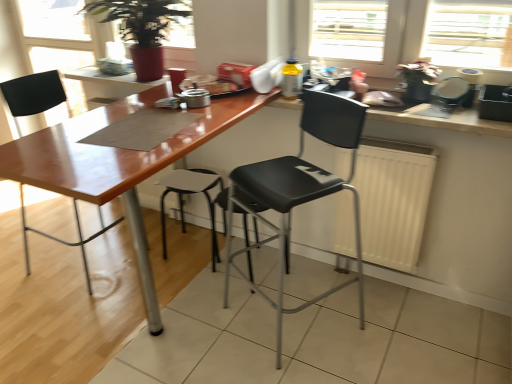
Question: Is black plastic chair at center, placed as the 1th chair when sorted from right to left, bigger than wooden countertop at upper right?

Choices:
 (A) yes
 (B) no

Answer: (A)

Question: From a real-world perspective, is black plastic chair at center, placed as the 1th chair when sorted from right to left, over wooden countertop at upper right?

Choices:
 (A) no
 (B) yes

Answer: (A)

Question: Is black plastic chair at center, placed as the 1th chair when sorted from right to left, next to wooden countertop at upper right?

Choices:
 (A) yes
 (B) no

Answer: (B)

Question: Is black plastic chair at center, placed as the 1th chair when sorted from right to left, thinner than wooden countertop at upper right?

Choices:
 (A) no
 (B) yes

Answer: (A)

Question: Can you confirm if black plastic chair at center, which is the second chair from left to right, is wider than wooden countertop at upper right?

Choices:
 (A) no
 (B) yes

Answer: (B)

Question: Which is correct: white matte radiator at center is inside matte black stool at center, or outside of it?

Choices:
 (A) outside
 (B) inside

Answer: (A)

Question: In terms of height, does white matte radiator at center look taller or shorter compared to matte black stool at center?

Choices:
 (A) short
 (B) tall

Answer: (B)

Question: In terms of size, does white matte radiator at center appear bigger or smaller than matte black stool at center?

Choices:
 (A) small
 (B) big

Answer: (A)

Question: Visually, is white matte radiator at center positioned to the left or to the right of matte black stool at center?

Choices:
 (A) right
 (B) left

Answer: (A)

Question: Considering their positions, is white matte radiator at center located in front of or behind black plastic chair at center, which is the second chair from left to right?

Choices:
 (A) front
 (B) behind

Answer: (B)

Question: Considering the positions of point (358, 180) and point (335, 190), is point (358, 180) closer or farther from the camera than point (335, 190)?

Choices:
 (A) closer
 (B) farther

Answer: (B)

Question: Is white matte radiator at center wider or thinner than black plastic chair at center, which is the second chair from left to right?

Choices:
 (A) wide
 (B) thin

Answer: (B)

Question: In terms of size, does white matte radiator at center appear bigger or smaller than black plastic chair at center, placed as the 1th chair when sorted from right to left?

Choices:
 (A) big
 (B) small

Answer: (B)

Question: Looking at their shapes, would you say wooden countertop at upper right is wider or thinner than matte black chair at left, which is the second chair from right to left?

Choices:
 (A) wide
 (B) thin

Answer: (B)

Question: Is wooden countertop at upper right to the left or to the right of matte black chair at left, which is the 1th chair from left to right, in the image?

Choices:
 (A) left
 (B) right

Answer: (B)